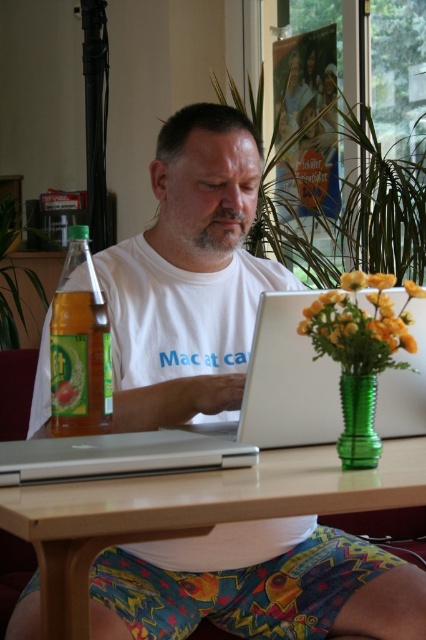
You are standing in front of the table and want to place a small object on the table. There are two points marked on the table where you can place it. The first point is at coordinate point[187,531] and the second point is at coordinate point[88,317]. Which point is closer to you?

Point[187,531] is closer to the camera than point[88,317], so the first point is closer to you.

You are a delivery person who needs to place a package on the table. The package is too large to fit between the white plastic laptop at center and the green glass vase at lower right. Where should you place the package on the table to avoid both objects?

Since the white plastic laptop at center is above the green glass vase at lower right, you should place the package below the green glass vase at lower right to avoid both objects.

You are a person who needs to take a video call using the camera on your laptop. The camera is located at the top of the screen. Can you adjust the laptop so that the distance between the white plastic laptop at center and the camera becomes closer than 1.22 meters?

The white plastic laptop at center and camera are 1.22 meters apart from each other. Since the camera is part of the laptop, you cannot adjust the distance between them. The distance remains fixed at 1.22 meters.